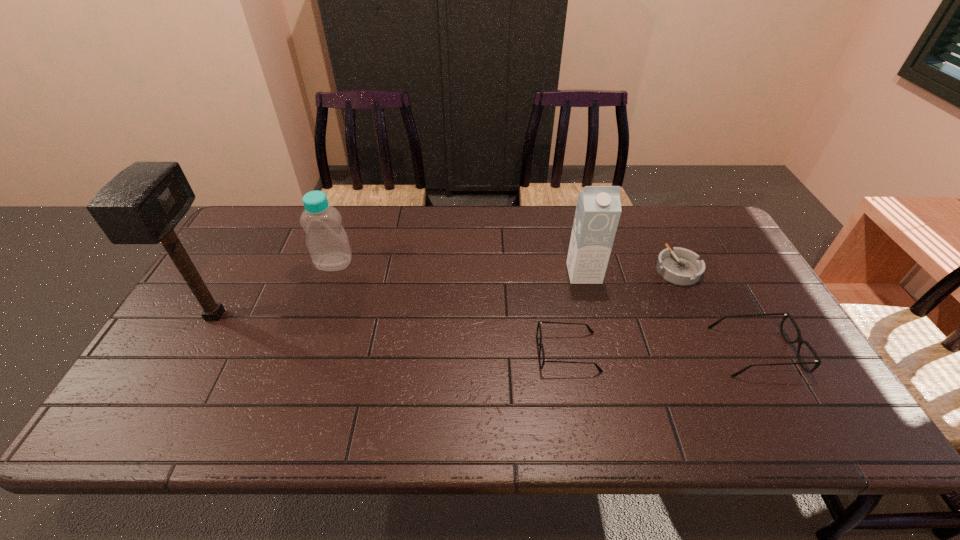
At what (x,y) coordinates should I click in order to perform the action: click on free point that keeps the spectacless evenly spaced on the left. Please return your answer as a coordinate pair (x, y). The image size is (960, 540). Looking at the image, I should click on (380, 353).